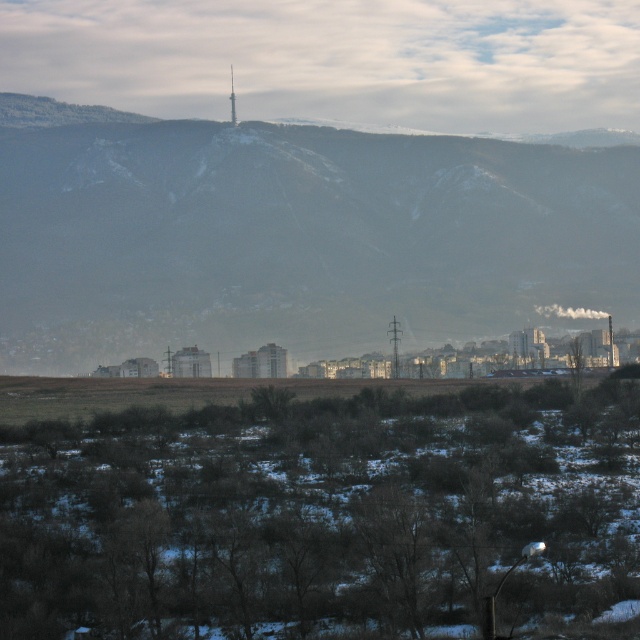
From the picture: Who is taller, snowy mountain range at upper center or metallic silver tower at center?

With more height is snowy mountain range at upper center.

Does snowy mountain range at upper center appear under metallic silver tower at center?

Indeed, snowy mountain range at upper center is positioned under metallic silver tower at center.

Between point (4, 340) and point (234, 96), which one is positioned in front?

Point (4, 340) is in front.

At what (x,y) coordinates should I click in order to perform the action: click on snowy mountain range at upper center. Please return your answer as a coordinate pair (x, y). The height and width of the screenshot is (640, 640). Looking at the image, I should click on (292, 234).